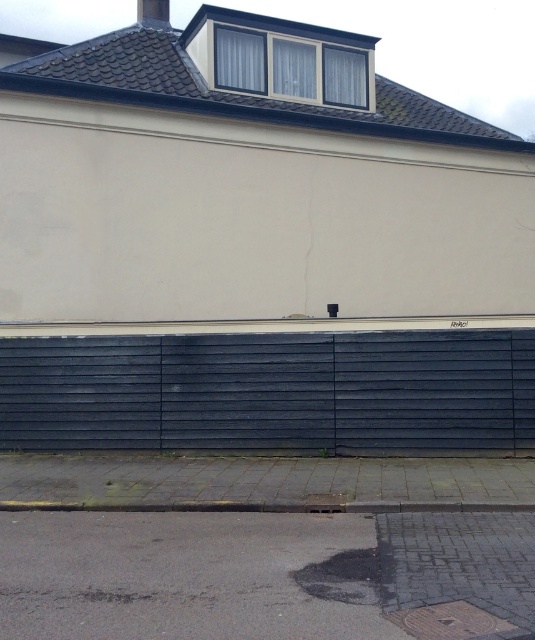
Is point (65, 625) closer to viewer compared to point (195, 500)?

That is True.

Does dark asphalt pavement at lower center have a larger size compared to gray concrete curb at lower center?

Indeed, dark asphalt pavement at lower center has a larger size compared to gray concrete curb at lower center.

What do you see at coordinates (266, 576) in the screenshot? I see `dark asphalt pavement at lower center` at bounding box center [266, 576].

You are a GUI agent. You are given a task and a screenshot of the screen. Output one action in this format:
    pyautogui.click(x=<x>, y=<y>)
    Task: Click on the dark asphalt pavement at lower center
    The image size is (535, 640).
    Given the screenshot: What is the action you would take?
    pyautogui.click(x=266, y=576)

Can you confirm if dark gray wood fence at lower center is wider than gray concrete curb at lower center?

No, dark gray wood fence at lower center is not wider than gray concrete curb at lower center.

Is dark gray wood fence at lower center to the right of gray concrete curb at lower center from the viewer's perspective?

In fact, dark gray wood fence at lower center is to the left of gray concrete curb at lower center.

The height and width of the screenshot is (640, 535). Identify the location of dark gray wood fence at lower center. (271, 392).

The image size is (535, 640). In order to click on dark gray wood fence at lower center in this screenshot , I will do `click(271, 392)`.

Who is higher up, dark asphalt pavement at lower center or dark gray wood fence at lower center?

dark gray wood fence at lower center

I want to click on dark asphalt pavement at lower center, so click(266, 576).

Where is `dark asphalt pavement at lower center`? dark asphalt pavement at lower center is located at coordinates (266, 576).